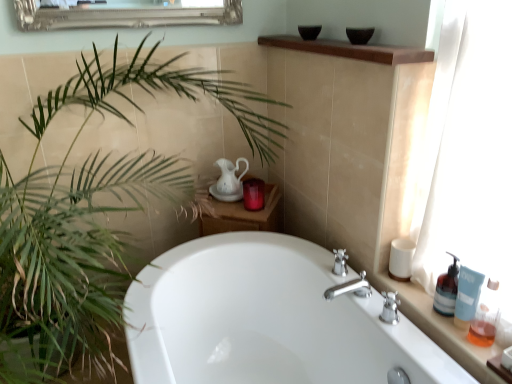
I want to click on free space between translucent glass soap dispenser at right, the second soap dispenser positioned from the front, and white matte cup at right, which is the 2th toiletry in front-to-back order, so click(416, 297).